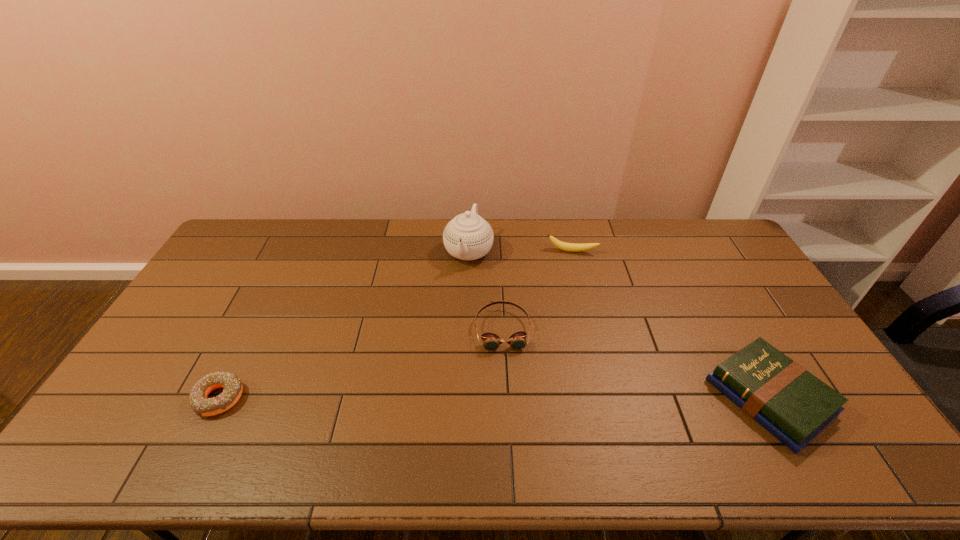
You are a GUI agent. You are given a task and a screenshot of the screen. Output one action in this format:
    pyautogui.click(x=<x>, y=<y>)
    Task: Click on the shortest object
    
    Given the screenshot: What is the action you would take?
    [x=232, y=386]

Find the location of `the leftmost object`. the leftmost object is located at coordinates pos(232,386).

The height and width of the screenshot is (540, 960). In order to click on book in this screenshot , I will do `click(792, 404)`.

Locate an element on the screen. This screenshot has width=960, height=540. goggles is located at coordinates (491, 341).

The image size is (960, 540). What are the coordinates of `the second object from right to left` in the screenshot? It's located at [569, 247].

At what (x,y) coordinates should I click in order to perform the action: click on the tallest object. Please return your answer as a coordinate pair (x, y). Looking at the image, I should click on (468, 236).

The width and height of the screenshot is (960, 540). What are the coordinates of `free point located 0.140m on the right of the doughnut` in the screenshot? It's located at (296, 398).

At what (x,y) coordinates should I click in order to perform the action: click on vacant area located on the back of the book. Please return your answer as a coordinate pair (x, y). The image size is (960, 540). Looking at the image, I should click on (703, 279).

You are a GUI agent. You are given a task and a screenshot of the screen. Output one action in this format:
    pyautogui.click(x=<x>, y=<y>)
    Task: Click on the vacant space located 0.110m through the lenses of the goggles
    
    Given the screenshot: What is the action you would take?
    pyautogui.click(x=509, y=384)

This screenshot has height=540, width=960. Identify the location of free region located through the lenses of the goggles. (508, 378).